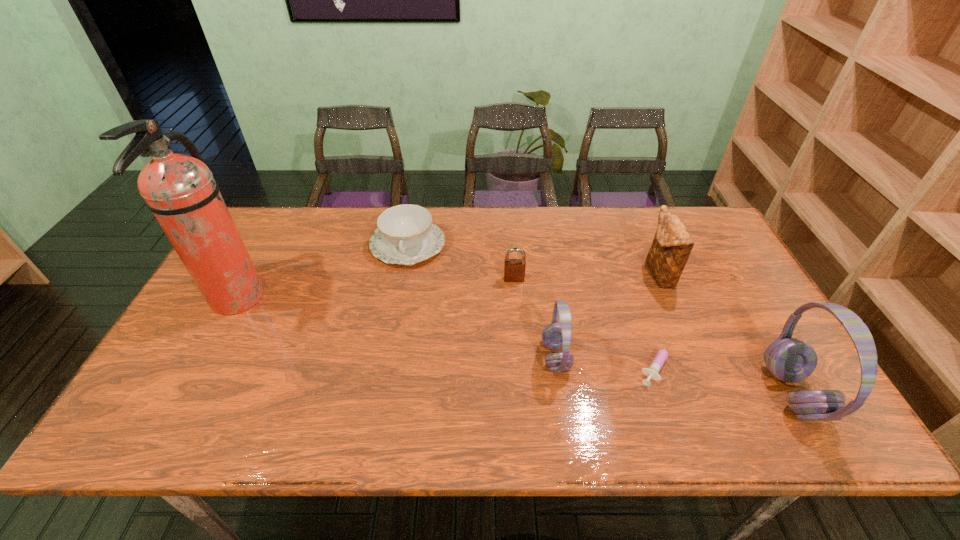
Image resolution: width=960 pixels, height=540 pixels. Identify the location of free space between the second tallest object and the shorter headset. (674, 375).

The height and width of the screenshot is (540, 960). Find the location of `blank region between the clutch bag and the padlock`. blank region between the clutch bag and the padlock is located at coordinates (587, 276).

Locate an element on the screen. This screenshot has height=540, width=960. blank region between the clutch bag and the leftmost object is located at coordinates point(447,286).

Select which object is the fifth closest to the fire extinguisher. Please provide its 2D coordinates. Your answer should be formatted as a tuple, i.e. [(x, y)], where the tuple contains the x and y coordinates of a point satisfying the conditions above.

[(672, 244)]

Find the location of `object that stands as the closest to the clutch bag`. object that stands as the closest to the clutch bag is located at coordinates (652, 371).

Identify the location of vacant area that satisfies the following two spatial constraints: 1. on the handle side of the chinaware; 2. at the nozzle of the leftmost object. (397, 299).

Locate an element on the screen. Image resolution: width=960 pixels, height=540 pixels. free space in the image that satisfies the following two spatial constraints: 1. at the nozzle of the syringe; 2. on the left side of the tallest object is located at coordinates (202, 362).

Where is `vacant space that satisfies the following two spatial constraints: 1. on the headband and ear cups of the shorter headset; 2. on the left side of the shortest object`? vacant space that satisfies the following two spatial constraints: 1. on the headband and ear cups of the shorter headset; 2. on the left side of the shortest object is located at coordinates (557, 362).

You are a GUI agent. You are given a task and a screenshot of the screen. Output one action in this format:
    pyautogui.click(x=<x>, y=<y>)
    Task: Click on the vacant space that satisfies the following two spatial constraints: 1. at the nozzle of the leftmost object; 2. on the back side of the syringe
    This screenshot has height=540, width=960.
    Given the screenshot: What is the action you would take?
    pyautogui.click(x=202, y=362)

You are a GUI agent. You are given a task and a screenshot of the screen. Output one action in this format:
    pyautogui.click(x=<x>, y=<y>)
    Task: Click on the free spot that satisfies the following two spatial constraints: 1. on the front-facing side of the fifth object from right to left; 2. on the left side of the syringe
    
    Given the screenshot: What is the action you would take?
    pyautogui.click(x=520, y=362)